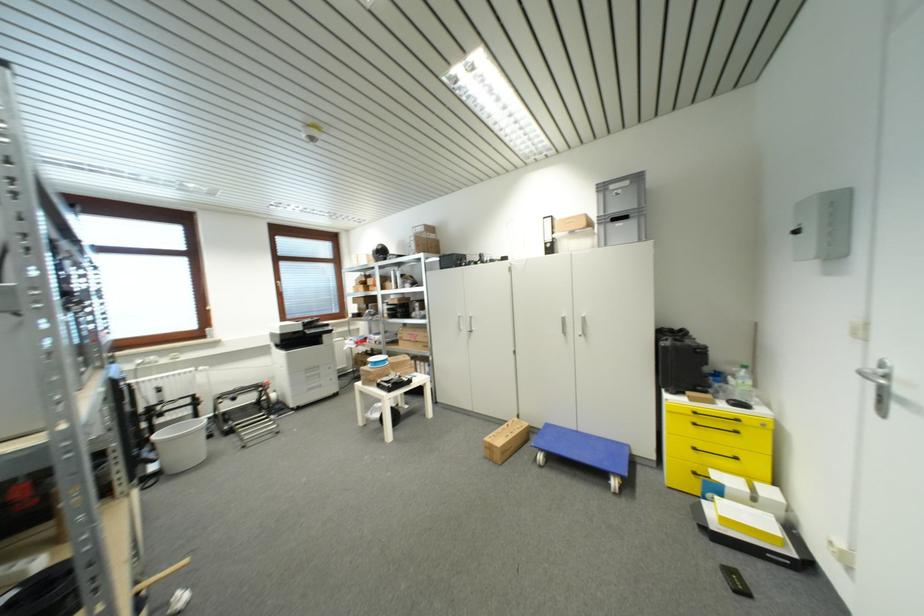
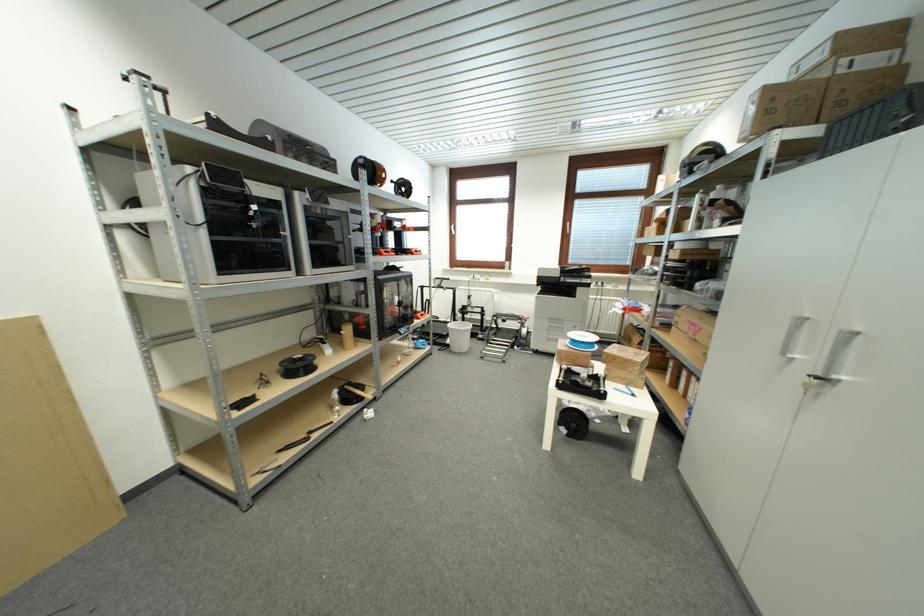
In the second image, find the point that corresponds to point 409,363 in the first image.

(634, 363)